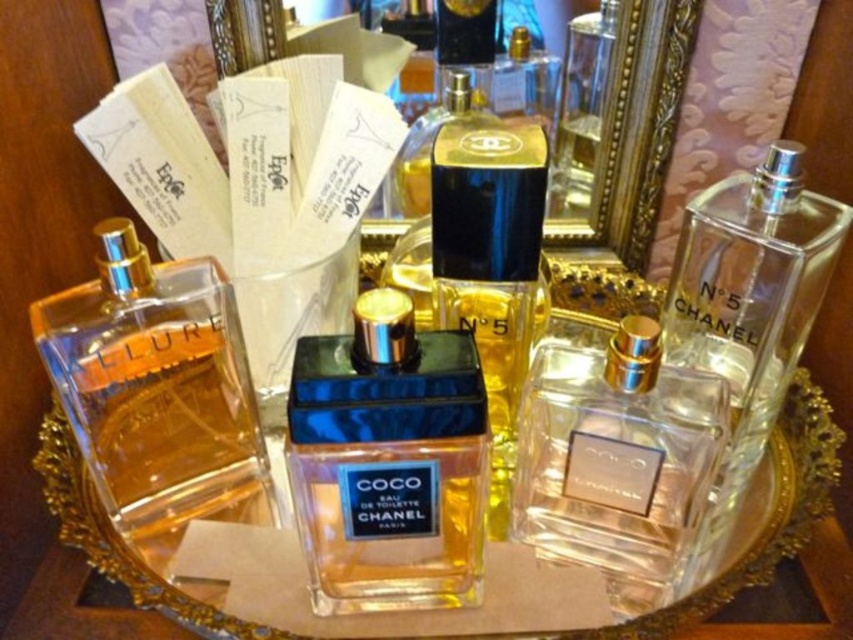
Question: Can you confirm if clear glass bottle at left is positioned to the left of clear glass perfume at center?

Choices:
 (A) yes
 (B) no

Answer: (A)

Question: Which point is closer to the camera taking this photo?

Choices:
 (A) (146, 413)
 (B) (386, 358)

Answer: (B)

Question: Does shiny blue glass perfume at center have a smaller size compared to clear glass bottle at left?

Choices:
 (A) no
 (B) yes

Answer: (B)

Question: Is shiny blue glass perfume at center wider than clear glass bottle at left?

Choices:
 (A) no
 (B) yes

Answer: (A)

Question: Which point is closer to the camera?

Choices:
 (A) clear glass perfume at center
 (B) clear glass bottle at left

Answer: (A)

Question: Which point appears closest to the camera in this image?

Choices:
 (A) (390, 464)
 (B) (689, 408)
 (C) (175, 524)

Answer: (A)